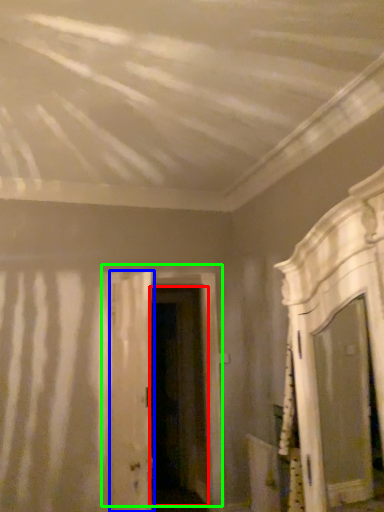
Question: Considering the real-world distances, which object is farthest from door (highlighted by a red box)? door (highlighted by a blue box) or door (highlighted by a green box)?

Choices:
 (A) door
 (B) door

Answer: (A)